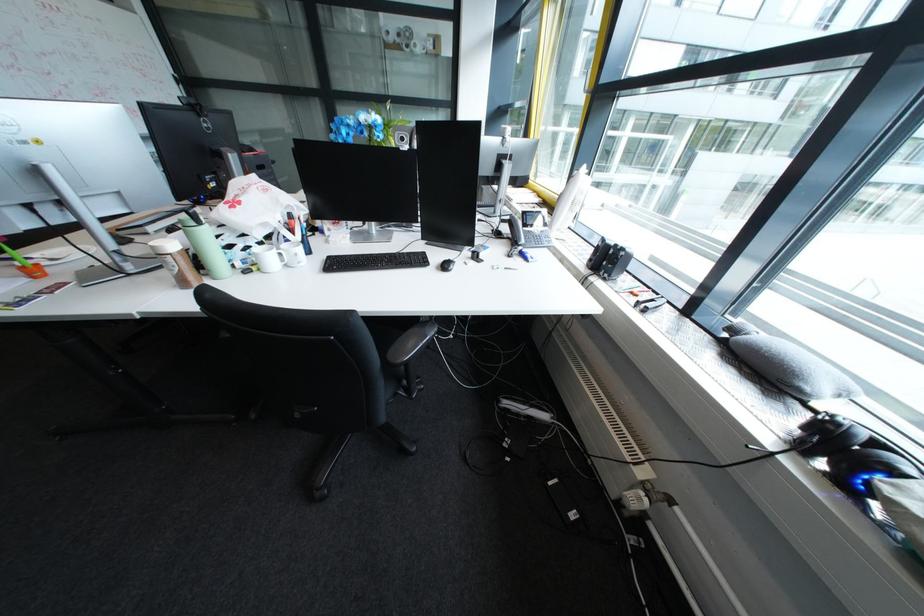
Locate an element on the screen. brown shaker bottle is located at coordinates (176, 262).